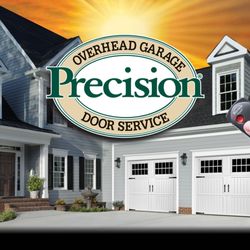
The image size is (250, 250). I want to click on front door, so click(7, 166).